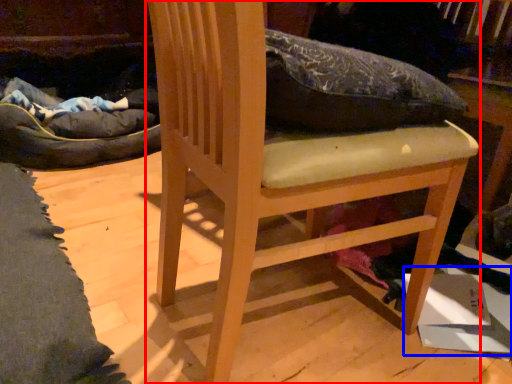
Question: Which of the following is the farthest to the observer, furniture (highlighted by a red box) or cardboard box (highlighted by a blue box)?

Choices:
 (A) furniture
 (B) cardboard box

Answer: (B)